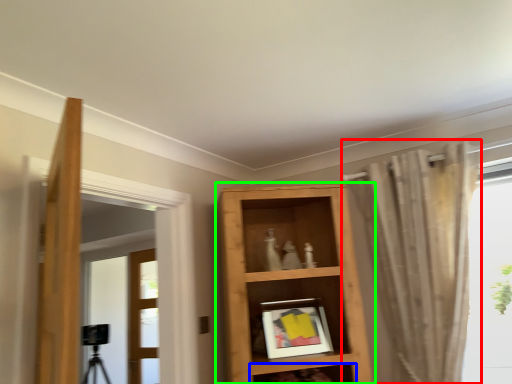
Question: Considering the real-world distances, which object is closest to curtain (highlighted by a red box)? shelf (highlighted by a blue box) or shelf (highlighted by a green box).

Choices:
 (A) shelf
 (B) shelf

Answer: (B)